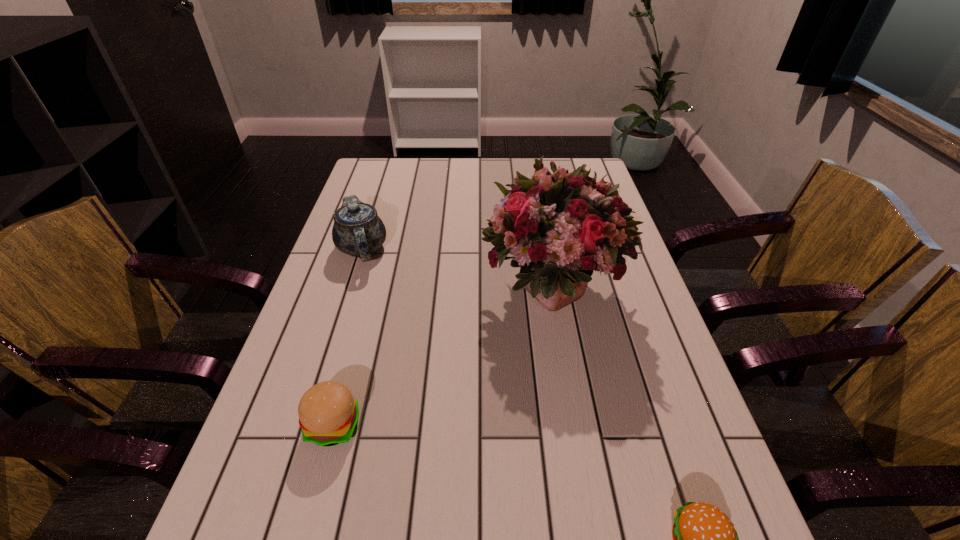
This screenshot has height=540, width=960. Identify the location of bouquet. (560, 227).

Where is `the third shortest object`? the third shortest object is located at coordinates point(358,231).

The width and height of the screenshot is (960, 540). Find the location of `the left hamburger`. the left hamburger is located at coordinates click(328, 414).

Where is `the second nearest object`? The width and height of the screenshot is (960, 540). the second nearest object is located at coordinates (328, 414).

The height and width of the screenshot is (540, 960). Find the location of `vacant area located on the front of the bouquet`. vacant area located on the front of the bouquet is located at coordinates (573, 414).

At what (x,y) coordinates should I click in order to perform the action: click on vacant space located from the spout of the second tallest object. Please return your answer as a coordinate pair (x, y). This screenshot has height=540, width=960. Looking at the image, I should click on (326, 361).

The image size is (960, 540). I want to click on vacant area located 0.190m on the back of the farther hamburger, so click(359, 331).

At what (x,y) coordinates should I click in order to perform the action: click on chinaware situated at the left edge. Please return your answer as a coordinate pair (x, y). This screenshot has width=960, height=540. Looking at the image, I should click on (358, 231).

At what (x,y) coordinates should I click in order to perform the action: click on hamburger positioned at the left edge. Please return your answer as a coordinate pair (x, y). Looking at the image, I should click on (328, 414).

Where is `object at the right edge`? The width and height of the screenshot is (960, 540). object at the right edge is located at coordinates (560, 227).